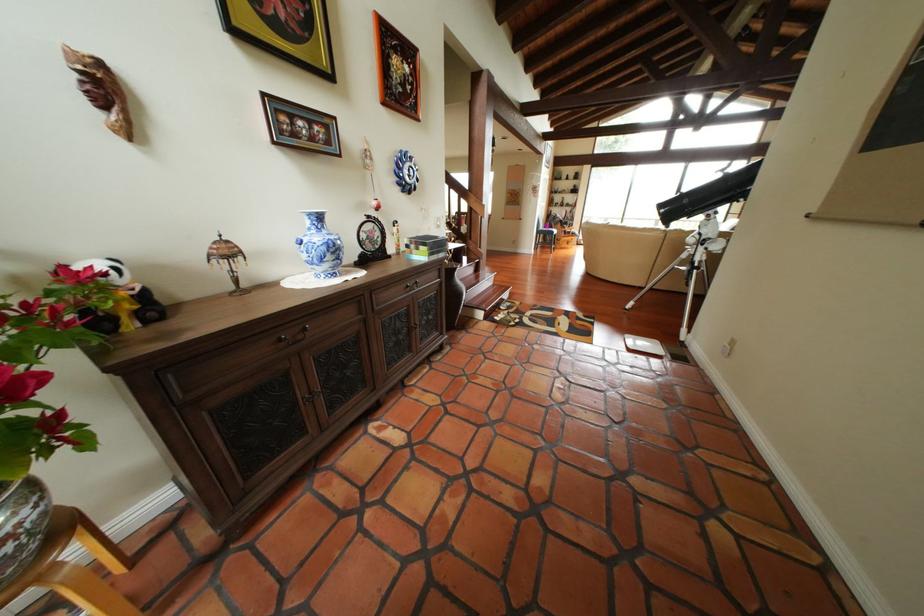
At what (x,y) coordinates should I click in order to perform the action: click on blue and white vase. Please return your answer as a coordinate pair (x, y). Looking at the image, I should click on pos(320,246).